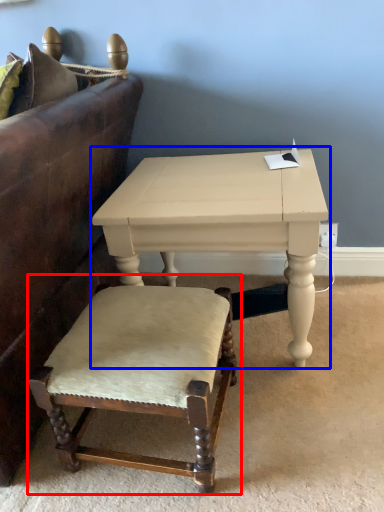
Question: Which point is closer to the camera, chair (highlighted by a red box) or table (highlighted by a blue box)?

Choices:
 (A) chair
 (B) table

Answer: (A)